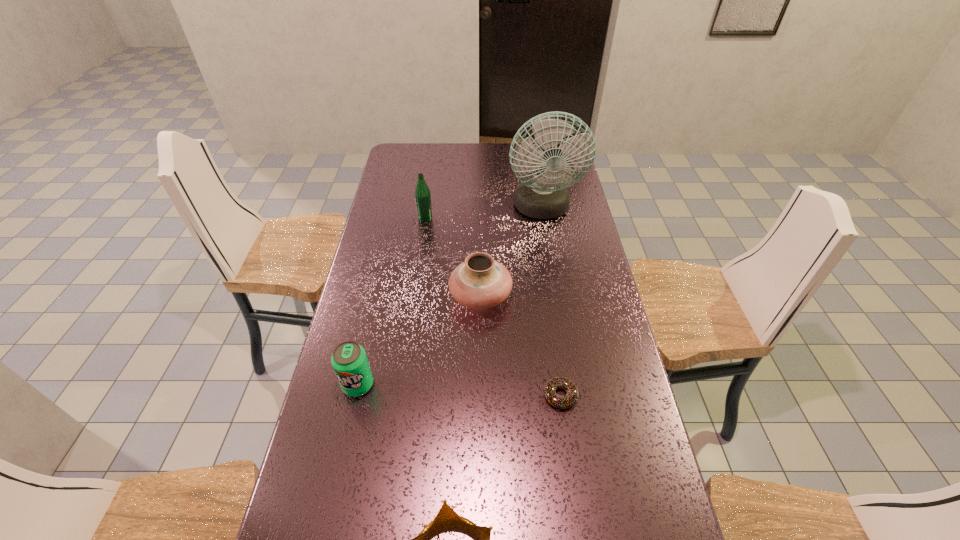
The image size is (960, 540). Find the location of `free location located 0.090m on the left of the doughnut`. free location located 0.090m on the left of the doughnut is located at coordinates (510, 396).

This screenshot has height=540, width=960. Find the location of `object present at the left edge`. object present at the left edge is located at coordinates (349, 360).

The image size is (960, 540). In order to click on fan at the right edge in this screenshot , I will do `click(545, 196)`.

Where is `doughnut at the right edge`? doughnut at the right edge is located at coordinates (570, 399).

Identify the location of free space at the left edge. (398, 238).

In the image, there is a desktop. Where is `vacant space at the right edge`? vacant space at the right edge is located at coordinates (580, 194).

You are a GUI agent. You are given a task and a screenshot of the screen. Output one action in this format:
    pyautogui.click(x=<x>, y=<y>)
    Task: Click on the free point between the doughnut and the pottery
    The height and width of the screenshot is (540, 960).
    Given the screenshot: What is the action you would take?
    tap(520, 346)

Where is `free space between the pottery and the shortest object`? free space between the pottery and the shortest object is located at coordinates (520, 346).

The image size is (960, 540). I want to click on free space between the shortest object and the pottery, so click(x=520, y=346).

In order to click on free spot between the pop soda and the fan in this screenshot , I will do `click(450, 297)`.